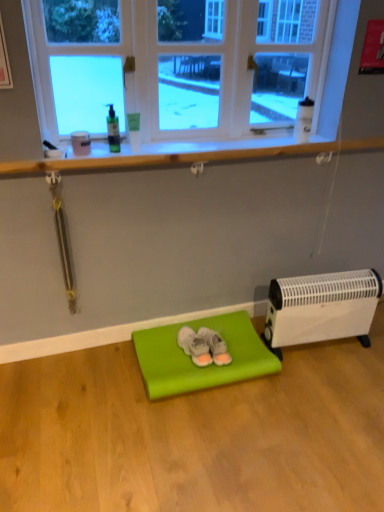
Question: Based on their positions, is clear glass window at upper center located to the left or right of matte green yoga mat at center?

Choices:
 (A) right
 (B) left

Answer: (B)

Question: From the image's perspective, is clear glass window at upper center located above or below matte green yoga mat at center?

Choices:
 (A) above
 (B) below

Answer: (A)

Question: Based on their relative distances, which object is nearer to the white plastic heater at lower right?

Choices:
 (A) matte green yoga mat at center
 (B) clear glass window at upper center
 (C) white suede sneakers at center, the second footwear in the left-to-right sequence
 (D) gray suede slippers at center, acting as the 2th footwear starting from the right

Answer: (A)

Question: Estimate the real-world distances between objects in this image. Which object is farther from the white suede sneakers at center, the second footwear in the left-to-right sequence?

Choices:
 (A) gray suede slippers at center, acting as the 2th footwear starting from the right
 (B) white plastic heater at lower right
 (C) clear glass window at upper center
 (D) matte green yoga mat at center

Answer: (C)